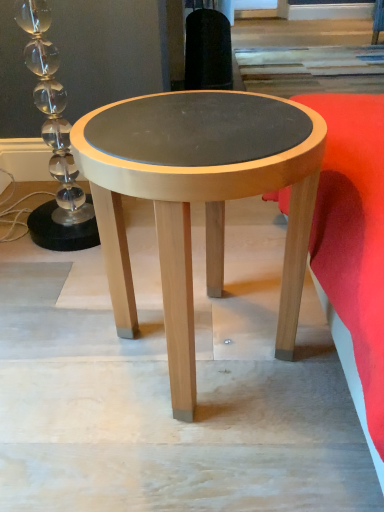
Question: From the image's perspective, would you say velvet red cushion at lower right is positioned over matte wood coffee table at center?

Choices:
 (A) yes
 (B) no

Answer: (A)

Question: Is velvet red cushion at lower right thinner than matte wood coffee table at center?

Choices:
 (A) yes
 (B) no

Answer: (B)

Question: From the image's perspective, is velvet red cushion at lower right beneath matte wood coffee table at center?

Choices:
 (A) yes
 (B) no

Answer: (B)

Question: Could you tell me if velvet red cushion at lower right is facing matte wood coffee table at center?

Choices:
 (A) yes
 (B) no

Answer: (B)

Question: Does velvet red cushion at lower right have a smaller size compared to matte wood coffee table at center?

Choices:
 (A) no
 (B) yes

Answer: (A)

Question: Can you confirm if velvet red cushion at lower right is shorter than matte wood coffee table at center?

Choices:
 (A) no
 (B) yes

Answer: (B)

Question: Does matte wood coffee table at center have a greater height compared to velvet red cushion at lower right?

Choices:
 (A) no
 (B) yes

Answer: (B)

Question: Does matte wood coffee table at center turn towards velvet red cushion at lower right?

Choices:
 (A) yes
 (B) no

Answer: (A)

Question: Is there a large distance between matte wood coffee table at center and velvet red cushion at lower right?

Choices:
 (A) no
 (B) yes

Answer: (A)

Question: Is matte wood coffee table at center surrounding velvet red cushion at lower right?

Choices:
 (A) no
 (B) yes

Answer: (A)

Question: Does matte wood coffee table at center come in front of velvet red cushion at lower right?

Choices:
 (A) yes
 (B) no

Answer: (B)

Question: From the image's perspective, is matte wood coffee table at center beneath velvet red cushion at lower right?

Choices:
 (A) yes
 (B) no

Answer: (A)

Question: Would you say matte wood coffee table at center is inside or outside velvet red cushion at lower right?

Choices:
 (A) outside
 (B) inside

Answer: (A)